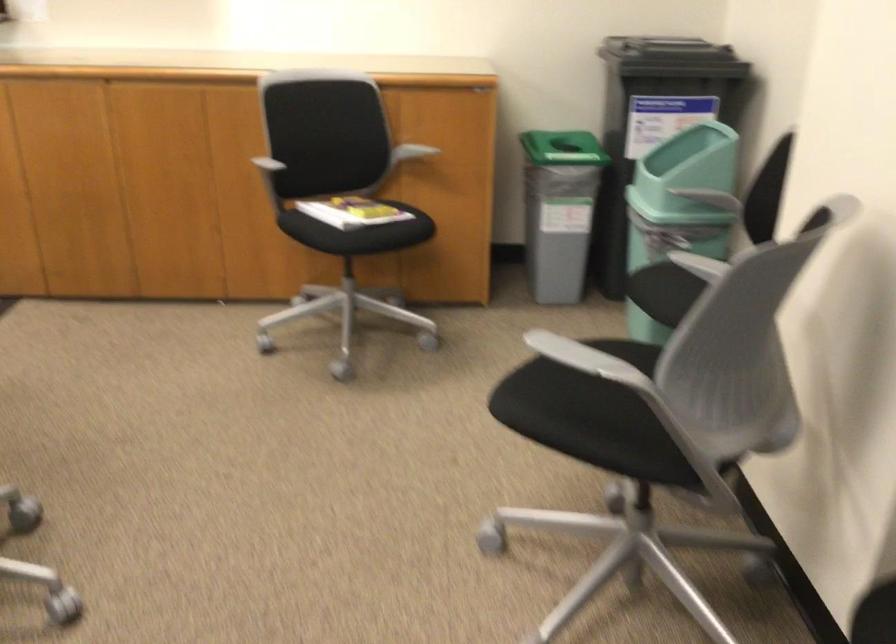
Locate an element on the screen. teal bin flap is located at coordinates (678, 207).